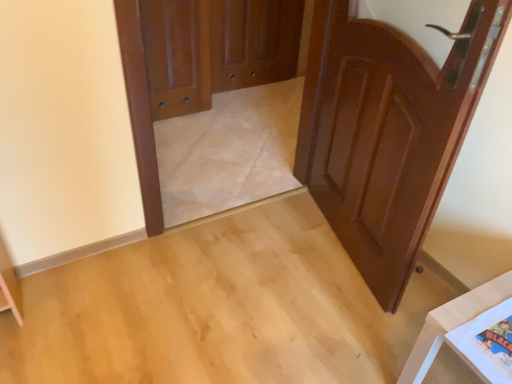
Find the location of `free point to the left of shiny brown door at right, the first door positioned from the front`. free point to the left of shiny brown door at right, the first door positioned from the front is located at coordinates (261, 253).